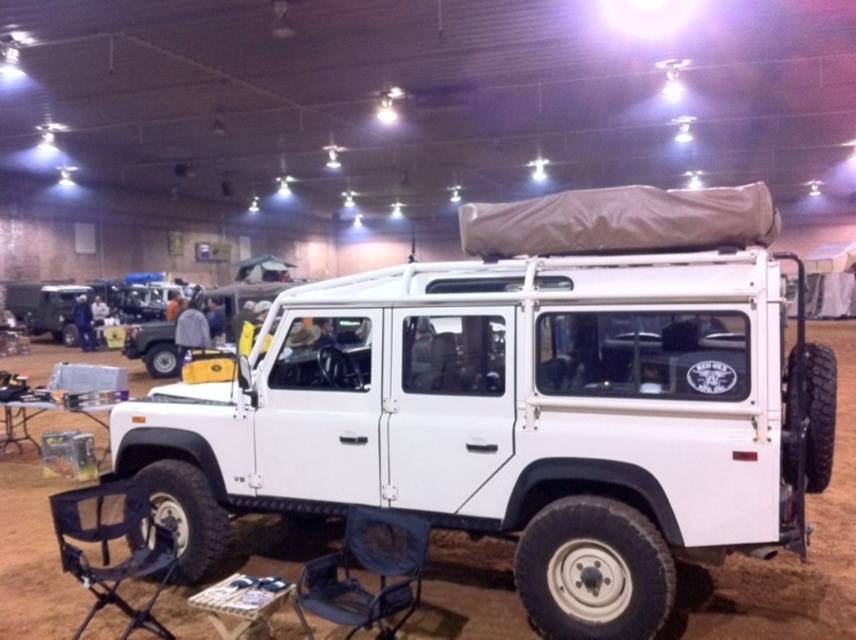
You are attending an outdoor event and need to sit down. You see a gray fabric chair at lower center and a black mesh folding chair at lower left. Which chair is located to the right of the other?

The gray fabric chair at lower center is positioned on the right side of black mesh folding chair at lower left.

You are standing at the entrance of the convention center and want to locate the white matte suv at center. According to the coordinates provided, where should you look to find it?

The white matte suv at center is located at coordinates point (526, 403).

You are standing in the exhibition hall and want to take a photo of the white matte suv at center. If your camera has a maximum focus range of 3 meters, will you need to move closer to take a clear picture?

The white matte suv at center is 3.74 meters away from you, which exceeds the camera maximum focus range of 3 meters. You need to move closer to ensure the camera can focus properly.